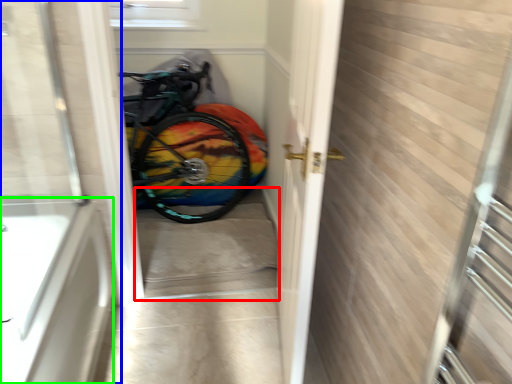
Question: Estimate the real-world distances between objects in this image. Which object is closer to stairwell (highlighted by a red box), door (highlighted by a blue box) or bath (highlighted by a green box)?

Choices:
 (A) door
 (B) bath

Answer: (B)